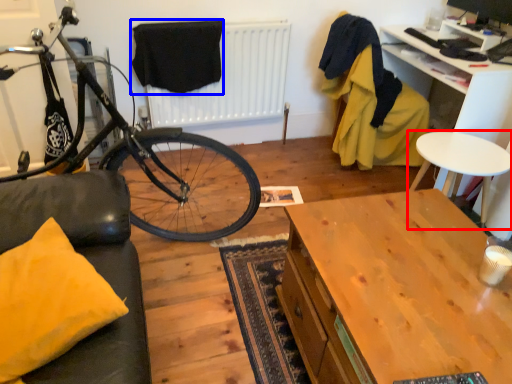
Question: Which object appears closest to the camera in this image, table (highlighted by a red box) or clothe (highlighted by a blue box)?

Choices:
 (A) table
 (B) clothe

Answer: (A)